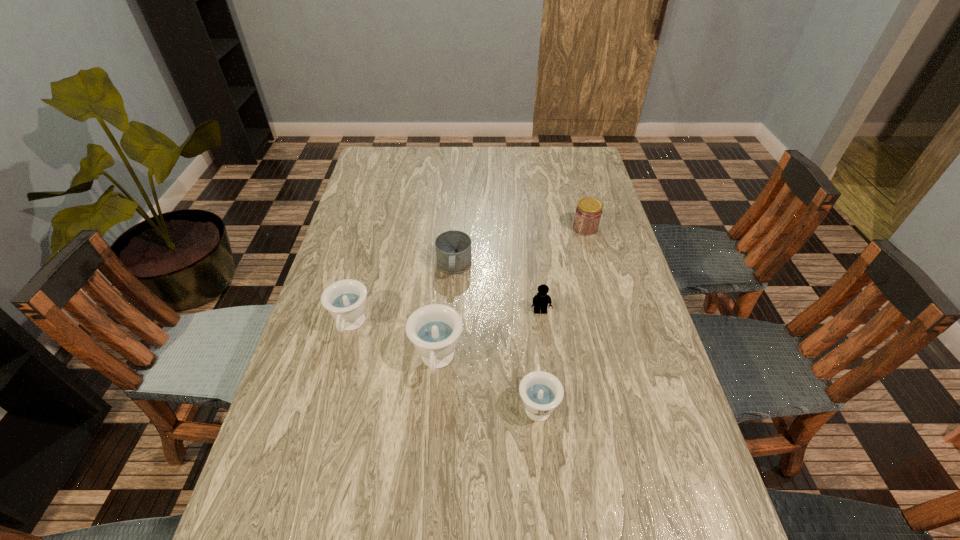
Identify the location of vacant point at the left edge. (370, 290).

This screenshot has height=540, width=960. In the image, there is a desktop. In order to click on vacant space at the right edge in this screenshot , I will do `click(607, 221)`.

Locate an element on the screen. The width and height of the screenshot is (960, 540). blank space at the far left corner is located at coordinates (384, 160).

Locate an element on the screen. This screenshot has width=960, height=540. vacant position at the near right corner of the desktop is located at coordinates (663, 483).

Identify the location of empty space that is in between the rightmost teacup and the Lego. The height and width of the screenshot is (540, 960). (539, 358).

At what (x,y) coordinates should I click in order to perform the action: click on vacant space that is in between the second teacup from right to left and the rightmost object. Please return your answer as a coordinate pair (x, y). This screenshot has height=540, width=960. Looking at the image, I should click on (512, 295).

This screenshot has width=960, height=540. Identify the location of vacant space that's between the leftmost teacup and the jam. (468, 277).

Where is `vacant space that's between the rightmost teacup and the second teacup from right to left`? The width and height of the screenshot is (960, 540). vacant space that's between the rightmost teacup and the second teacup from right to left is located at coordinates (487, 383).

At what (x,y) coordinates should I click in order to perform the action: click on unoccupied position between the mug and the shortest teacup. Please return your answer as a coordinate pair (x, y). The height and width of the screenshot is (540, 960). Looking at the image, I should click on (495, 335).

The image size is (960, 540). What are the coordinates of `unoccupied area between the mug and the Lego` in the screenshot? It's located at (497, 289).